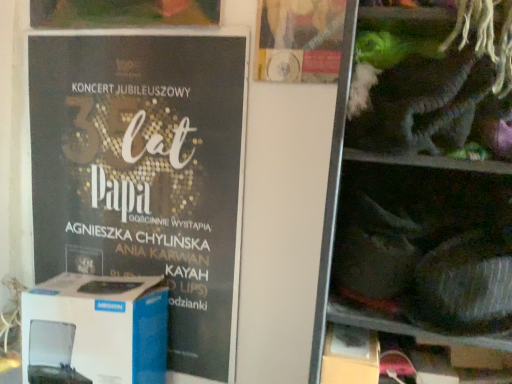
Question: Does shiny plastic toys at right have a smaller size compared to white cardboard box at left?

Choices:
 (A) no
 (B) yes

Answer: (A)

Question: Does shiny plastic toys at right appear on the right side of white cardboard box at left?

Choices:
 (A) no
 (B) yes

Answer: (B)

Question: Can you confirm if shiny plastic toys at right is wider than white cardboard box at left?

Choices:
 (A) no
 (B) yes

Answer: (B)

Question: Is shiny plastic toys at right not close to white cardboard box at left?

Choices:
 (A) no
 (B) yes

Answer: (A)

Question: From the image's perspective, is shiny plastic toys at right above white cardboard box at left?

Choices:
 (A) no
 (B) yes

Answer: (B)

Question: Is shiny plastic toys at right looking in the opposite direction of white cardboard box at left?

Choices:
 (A) no
 (B) yes

Answer: (A)

Question: Is matte black poster at left smaller than matte gold poster at upper center?

Choices:
 (A) no
 (B) yes

Answer: (A)

Question: Is matte black poster at left to the left of matte gold poster at upper center from the viewer's perspective?

Choices:
 (A) no
 (B) yes

Answer: (B)

Question: From a real-world perspective, is matte black poster at left under matte gold poster at upper center?

Choices:
 (A) no
 (B) yes

Answer: (B)

Question: Would you say matte gold poster at upper center is part of matte black poster at left's contents?

Choices:
 (A) yes
 (B) no

Answer: (B)

Question: From the image's perspective, is matte black poster at left below matte gold poster at upper center?

Choices:
 (A) no
 (B) yes

Answer: (B)

Question: From a real-world perspective, does matte black poster at left stand above matte gold poster at upper center?

Choices:
 (A) no
 (B) yes

Answer: (A)

Question: From a real-world perspective, is matte black poster at left below white cardboard box at left?

Choices:
 (A) no
 (B) yes

Answer: (A)